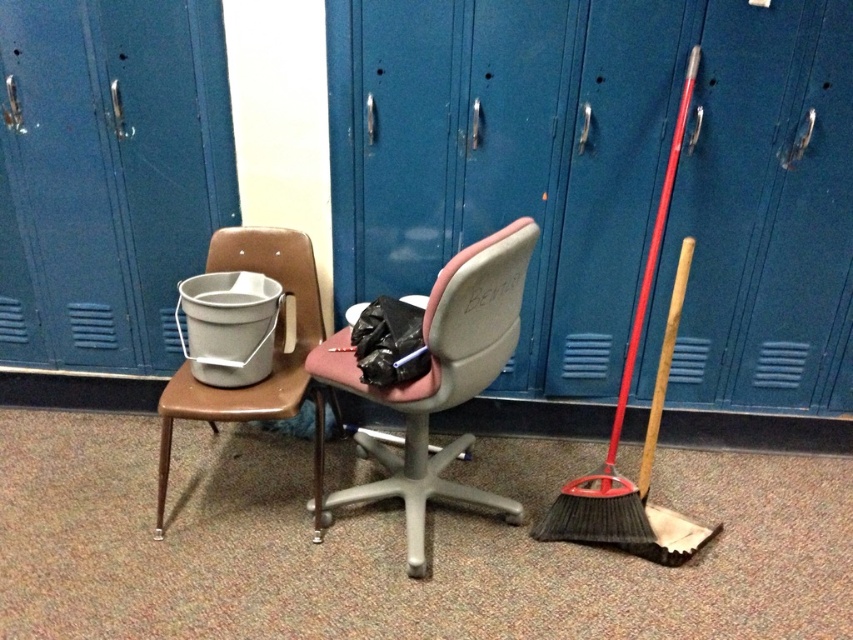
Between metallic brown chair at left and wooden handle broom at right, which one is positioned lower?

metallic brown chair at left

Does metallic brown chair at left have a greater width compared to wooden handle broom at right?

No, metallic brown chair at left is not wider than wooden handle broom at right.

I want to click on metallic brown chair at left, so click(271, 355).

From the picture: Is pink fabric office chair at center below metallic brown chair at left?

No, pink fabric office chair at center is not below metallic brown chair at left.

Is point (498, 358) more distant than point (247, 397)?

No, it is not.

Does point (469, 358) come closer to viewer compared to point (312, 323)?

Yes, point (469, 358) is closer to viewer.

This screenshot has height=640, width=853. I want to click on pink fabric office chair at center, so click(x=440, y=380).

Which is above, pink fabric office chair at center or wooden handle broom at right?

wooden handle broom at right is higher up.

Which is in front, point (492, 378) or point (654, 412)?

Positioned in front is point (492, 378).

Measure the distance between pink fabric office chair at center and camera.

A distance of 1.62 meters exists between pink fabric office chair at center and camera.

Where is `pink fabric office chair at center`? pink fabric office chair at center is located at coordinates (440, 380).